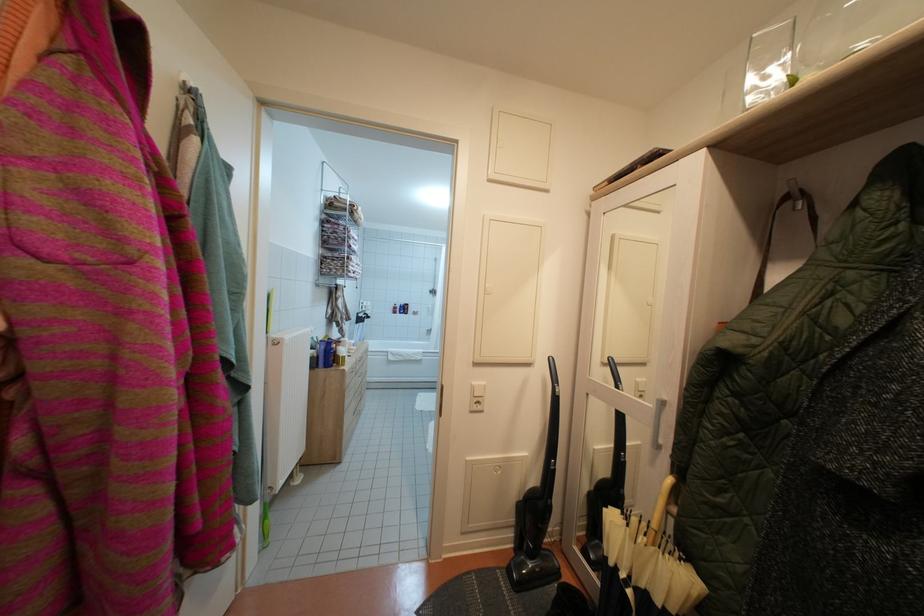
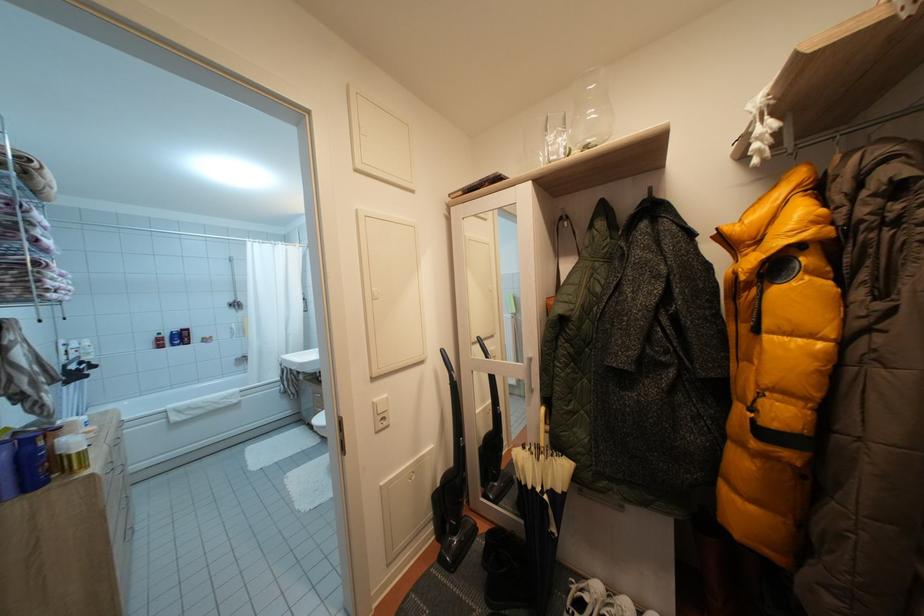
Question: Based on the continuous images, in which direction is the camera rotating? Reply with the corresponding letter.

Choices:
 (A) Left
 (B) Right
 (C) Up
 (D) Down

Answer: (B)